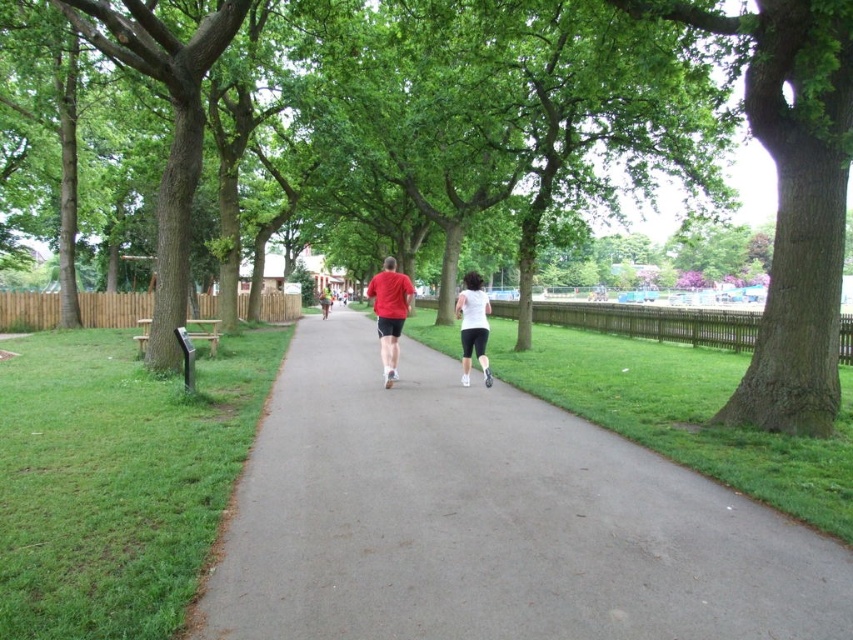
Question: Is white matte shorts at center thinner than matte red shorts at center?

Choices:
 (A) no
 (B) yes

Answer: (B)

Question: Estimate the real-world distances between objects in this image. Which object is farther from the gray asphalt path at center?

Choices:
 (A) matte red shorts at center
 (B) green leafy tree at center
 (C) matte red t-shirt at center
 (D) white matte shorts at center

Answer: (A)

Question: Based on their relative distances, which object is nearer to the gray asphalt path at center?

Choices:
 (A) matte red shorts at center
 (B) green leafy tree at center

Answer: (B)

Question: Does matte red t-shirt at center have a greater width compared to matte red shorts at center?

Choices:
 (A) yes
 (B) no

Answer: (B)

Question: Observing the image, what is the correct spatial positioning of gray asphalt path at center in reference to matte red t-shirt at center?

Choices:
 (A) left
 (B) right

Answer: (B)

Question: Which of these objects is positioned closest to the white matte shorts at center?

Choices:
 (A) gray asphalt path at center
 (B) green leafy tree at center
 (C) matte red t-shirt at center
 (D) matte red shorts at center

Answer: (C)